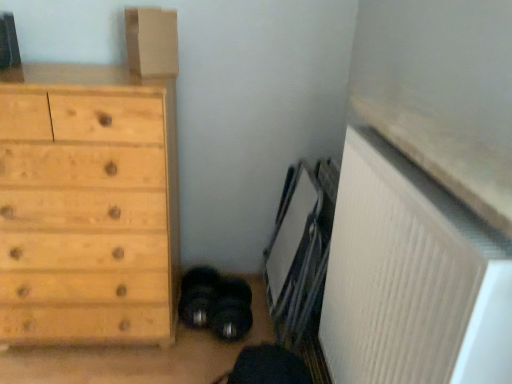
Question: Is matte cardboard box at upper left positioned beyond the bounds of white ribbed radiator at lower right?

Choices:
 (A) yes
 (B) no

Answer: (A)

Question: Is matte cardboard box at upper left next to white ribbed radiator at lower right?

Choices:
 (A) no
 (B) yes

Answer: (A)

Question: From a real-world perspective, is matte cardboard box at upper left located beneath white ribbed radiator at lower right?

Choices:
 (A) yes
 (B) no

Answer: (B)

Question: Is matte cardboard box at upper left facing towards white ribbed radiator at lower right?

Choices:
 (A) yes
 (B) no

Answer: (B)

Question: Is the position of matte cardboard box at upper left more distant than that of white ribbed radiator at lower right?

Choices:
 (A) no
 (B) yes

Answer: (B)

Question: Considering their positions, is natural wood chest of drawers at left located in front of or behind white ribbed radiator at lower right?

Choices:
 (A) behind
 (B) front

Answer: (A)

Question: From the image's perspective, is natural wood chest of drawers at left located above or below white ribbed radiator at lower right?

Choices:
 (A) below
 (B) above

Answer: (B)

Question: Is natural wood chest of drawers at left situated inside white ribbed radiator at lower right or outside?

Choices:
 (A) outside
 (B) inside

Answer: (A)

Question: From a real-world perspective, is natural wood chest of drawers at left above or below white ribbed radiator at lower right?

Choices:
 (A) above
 (B) below

Answer: (B)

Question: Relative to natural wood chest of drawers at left, is matte cardboard box at upper left in front or behind?

Choices:
 (A) behind
 (B) front

Answer: (A)

Question: Considering the positions of matte cardboard box at upper left and natural wood chest of drawers at left in the image, is matte cardboard box at upper left taller or shorter than natural wood chest of drawers at left?

Choices:
 (A) short
 (B) tall

Answer: (A)

Question: From a real-world perspective, is matte cardboard box at upper left positioned above or below natural wood chest of drawers at left?

Choices:
 (A) above
 (B) below

Answer: (A)

Question: Considering the positions of point (131, 51) and point (132, 177), is point (131, 51) closer or farther from the camera than point (132, 177)?

Choices:
 (A) farther
 (B) closer

Answer: (A)

Question: From a real-world perspective, relative to matte cardboard box at upper left, is white ribbed radiator at lower right vertically above or below?

Choices:
 (A) below
 (B) above

Answer: (A)

Question: Is white ribbed radiator at lower right spatially inside matte cardboard box at upper left, or outside of it?

Choices:
 (A) outside
 (B) inside

Answer: (A)